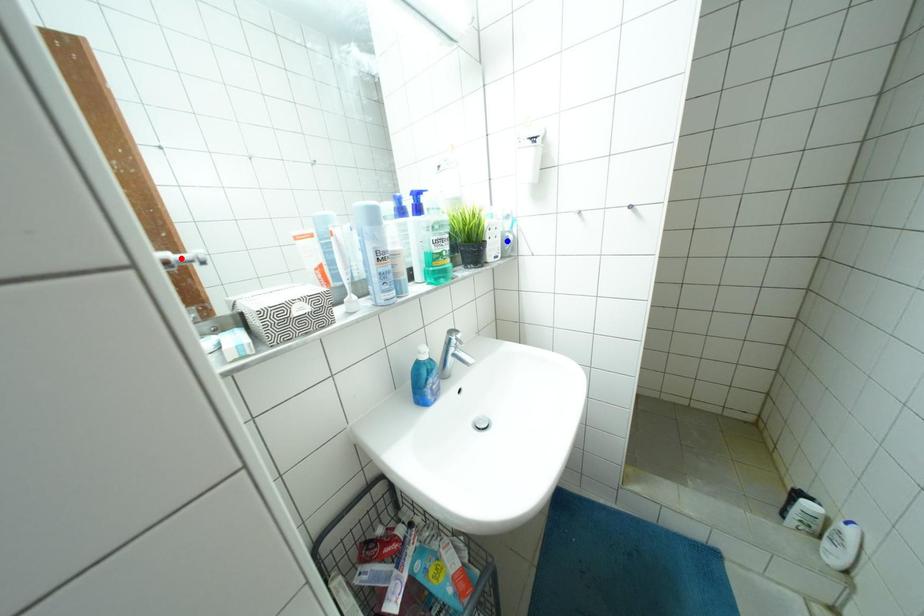
Question: Which of the two points in the image is closer to the camera?

Choices:
 (A) Blue point is closer.
 (B) Red point is closer.

Answer: (B)